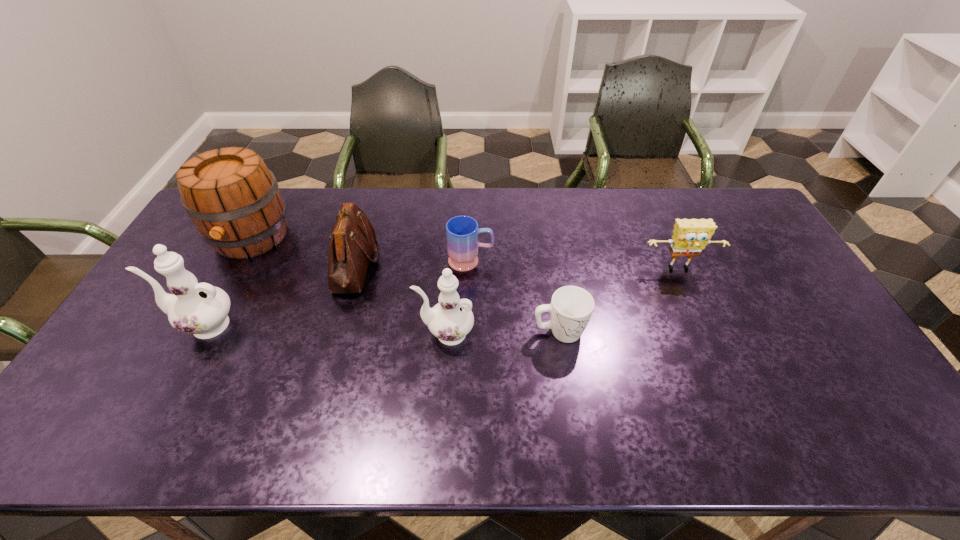
Find the location of a particular element. The width and height of the screenshot is (960, 540). the taller chinaware is located at coordinates (201, 309).

Where is `the shorter chinaware`? The image size is (960, 540). the shorter chinaware is located at coordinates (450, 320).

Identify the location of cider. (233, 199).

The height and width of the screenshot is (540, 960). What are the coordinates of `the left mug` in the screenshot? It's located at [x=462, y=232].

Identify the location of the fifth object from right to left. (352, 242).

At what (x,y) coordinates should I click in order to perform the action: click on shoulder bag. Please return your answer as a coordinate pair (x, y). This screenshot has height=540, width=960. Looking at the image, I should click on (352, 242).

The image size is (960, 540). I want to click on the second object from right to left, so click(x=571, y=307).

Image resolution: width=960 pixels, height=540 pixels. Find the location of `the right mug`. the right mug is located at coordinates (571, 307).

The image size is (960, 540). Identify the location of the third shortest object. (690, 236).

Identify the location of sponge. Image resolution: width=960 pixels, height=540 pixels. pyautogui.click(x=690, y=236).